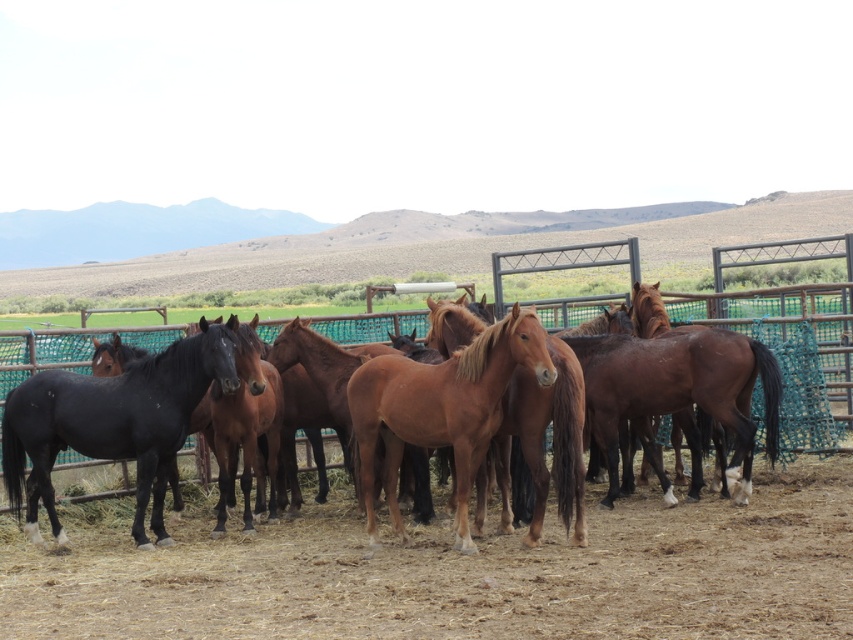
Question: Considering the real-world distances, which object is closest to the shiny brown horse at center?

Choices:
 (A) shiny black horse at left
 (B) brown glossy horse at center

Answer: (A)

Question: Is shiny brown horse at center positioned before shiny black horse at left?

Choices:
 (A) no
 (B) yes

Answer: (A)

Question: Does brown dry dirt at center have a greater width compared to shiny brown horse at center?

Choices:
 (A) yes
 (B) no

Answer: (B)

Question: Estimate the real-world distances between objects in this image. Which object is farther from the brown glossy horse at center?

Choices:
 (A) shiny black horse at left
 (B) shiny brown horse at center

Answer: (A)

Question: Considering the relative positions of shiny brown horse at center and brown glossy horse at center in the image provided, where is shiny brown horse at center located with respect to brown glossy horse at center?

Choices:
 (A) right
 (B) left

Answer: (B)

Question: Among these objects, which one is farthest from the camera?

Choices:
 (A) shiny black horse at left
 (B) brown dry dirt at center
 (C) shiny brown horse at center

Answer: (C)